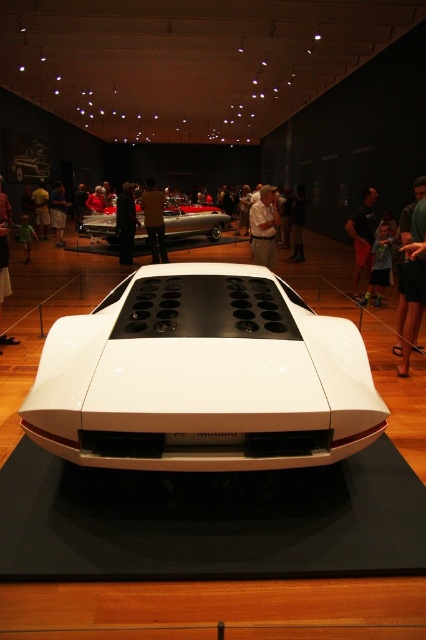
You are a security guard in the exhibition hall and need to check the distance between the black fabric pants at center and the brown leather jacket at center. The security protocol requires that all items must be at least 10 feet apart for safety. Can you confirm if they meet this requirement?

The black fabric pants at center and brown leather jacket at center are 13.69 feet apart, which exceeds the minimum required distance of 10 feet. Therefore, they meet the safety requirement.

You are standing in the exhibition space and want to take a photo of the car model. The camera you are using has a focal length of 50mm and a sensor size of 24mm x 36mm. If the point corresponding to the car model in the image is located at coordinates point (362, 268), which is 8.07 meters away from the camera, what is the actual distance in meters between the car model and the camera?

The distance of point (362, 268) from the camera is 8.07 meters, so the actual distance between the car model and the camera is 8.07 meters.

You are a security guard in the exhibition hall. You notice two items at the center of the room that might belong to a visitor who left them behind. The items are the black fabric pants at center and the brown leather jacket at center. Which item is closer to the floor?

The black fabric pants at center is below brown leather jacket at center, so the black fabric pants at center is closer to the floor.